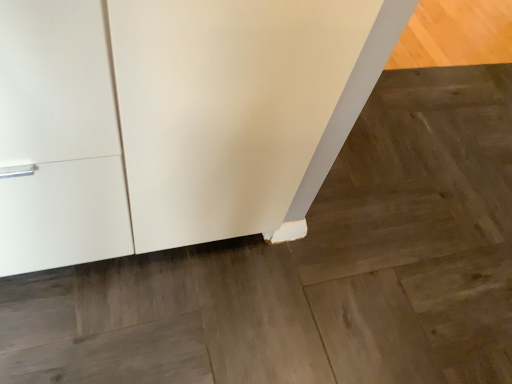
Question: Should I look upward or downward to see matte white cupboard at lower left?

Choices:
 (A) up
 (B) down

Answer: (A)